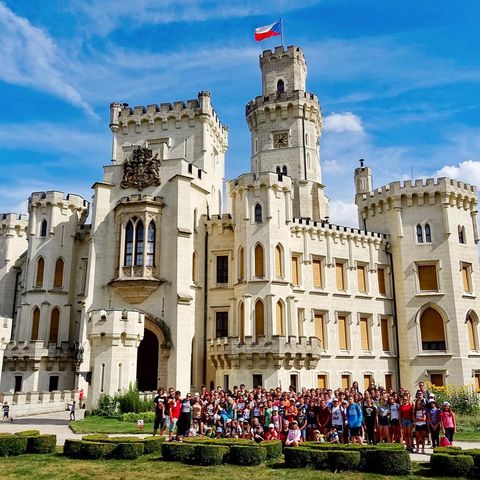
Locate an element on the screen. Image resolution: width=480 pixels, height=480 pixels. tall green plants is located at coordinates pyautogui.click(x=114, y=400), pyautogui.click(x=127, y=400), pyautogui.click(x=138, y=400), pyautogui.click(x=459, y=402), pyautogui.click(x=475, y=402), pyautogui.click(x=442, y=394).